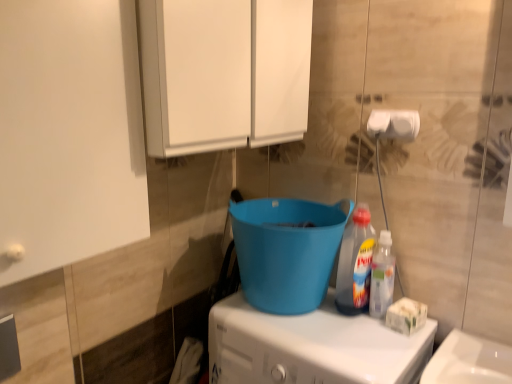
Identify the location of blank space to the left of translucent plastic bottle at right, the second bottle positioned from the left. (331, 326).